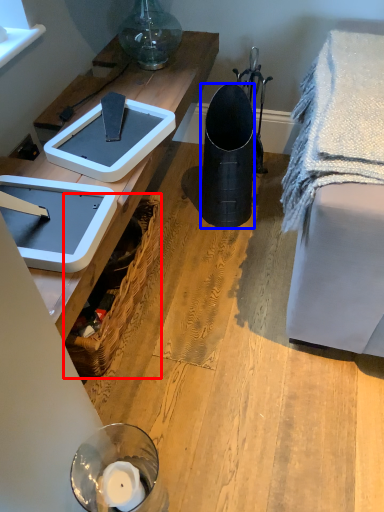
Question: Which object appears farthest to the camera in this image, picnic basket (highlighted by a red box) or trash bin/can (highlighted by a blue box)?

Choices:
 (A) picnic basket
 (B) trash bin/can

Answer: (B)